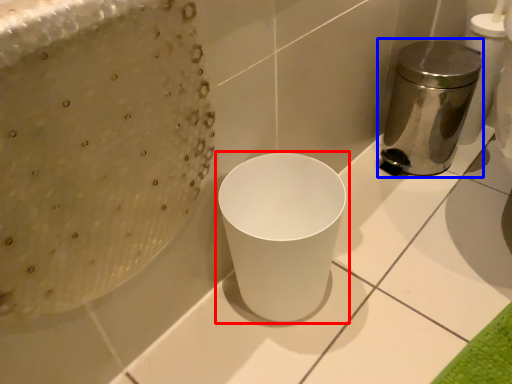
Question: Among these objects, which one is nearest to the camera, waste container (highlighted by a red box) or appliance (highlighted by a blue box)?

Choices:
 (A) waste container
 (B) appliance

Answer: (A)